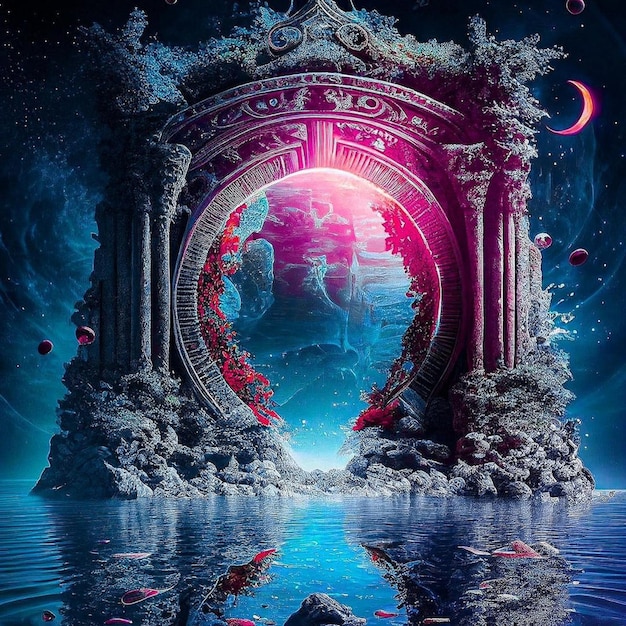
The height and width of the screenshot is (626, 626). What are the coordinates of `archway` in the screenshot? It's located at (310, 146).